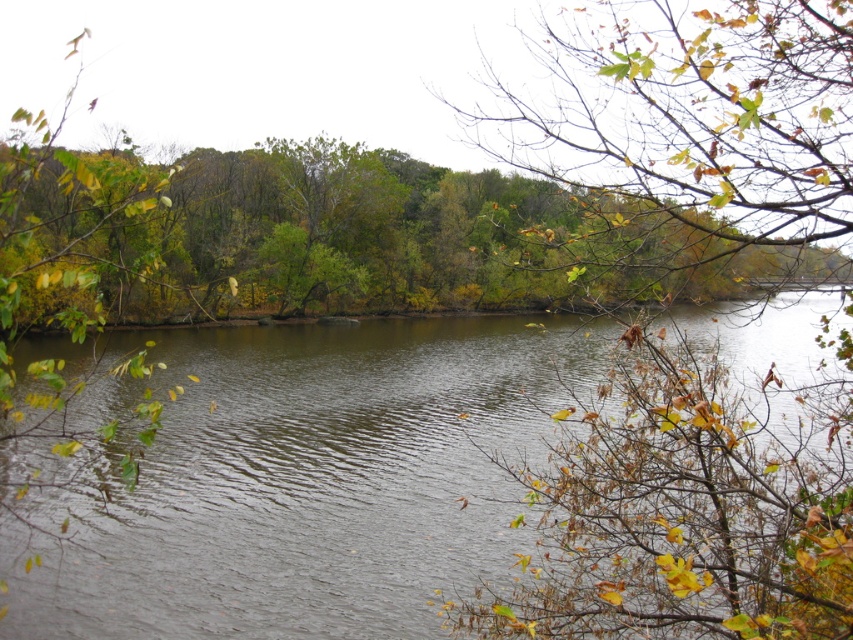
You are standing in the serene natural scene described. You see a point marked at coordinates (689, 513). What is this point located on?

The point at coordinates (689, 513) is located on green matte leaves at upper right.

Looking at this image, you are an artist planning to paint this scene. You want to ensure the dark brown water at center and the green matte leaves at upper right are proportionally accurate. Which object should you paint first to maintain the correct vertical positioning?

The dark brown water at center should be painted first since it is taller than the green matte leaves at upper right, ensuring proper vertical alignment.